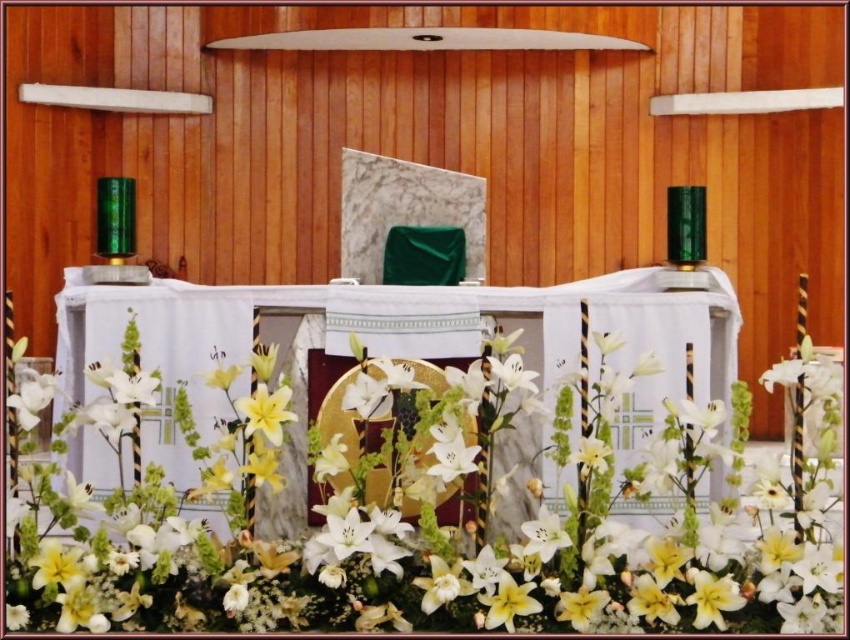
Question: Does white lilies at center appear on the right side of yellow matte lily at center?

Choices:
 (A) no
 (B) yes

Answer: (B)

Question: Is the position of white fabric altar at center more distant than that of yellow matte lily at center?

Choices:
 (A) yes
 (B) no

Answer: (A)

Question: Among these objects, which one is farthest from the camera?

Choices:
 (A) white fabric altar at center
 (B) yellow matte lily at center

Answer: (A)

Question: Which point is farther from the camera taking this photo?

Choices:
 (A) (289, 420)
 (B) (824, 532)

Answer: (B)

Question: Which object appears closest to the camera in this image?

Choices:
 (A) white fabric altar at center
 (B) yellow matte lily at center

Answer: (B)

Question: Is white lilies at center wider than yellow matte lily at center?

Choices:
 (A) yes
 (B) no

Answer: (A)